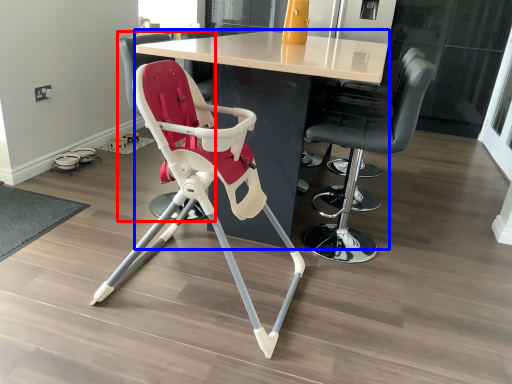
Question: Which of the following is the closest to the observer, chair (highlighted by a red box) or table (highlighted by a blue box)?

Choices:
 (A) chair
 (B) table

Answer: (B)